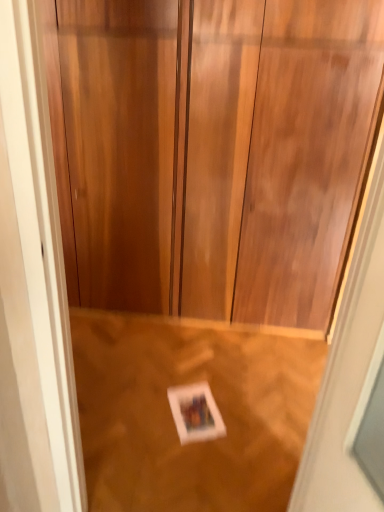
Question: Considering their positions, is wooden door at center located in front of or behind wooden floor at lower center?

Choices:
 (A) behind
 (B) front

Answer: (B)

Question: Is wooden door at center bigger or smaller than wooden floor at lower center?

Choices:
 (A) small
 (B) big

Answer: (B)

Question: Considering the real-world distances, which object is farthest from the wooden door at center?

Choices:
 (A) white paper at center
 (B) wooden floor at lower center

Answer: (A)

Question: Which object is the farthest from the white paper at center?

Choices:
 (A) wooden floor at lower center
 (B) wooden door at center

Answer: (B)